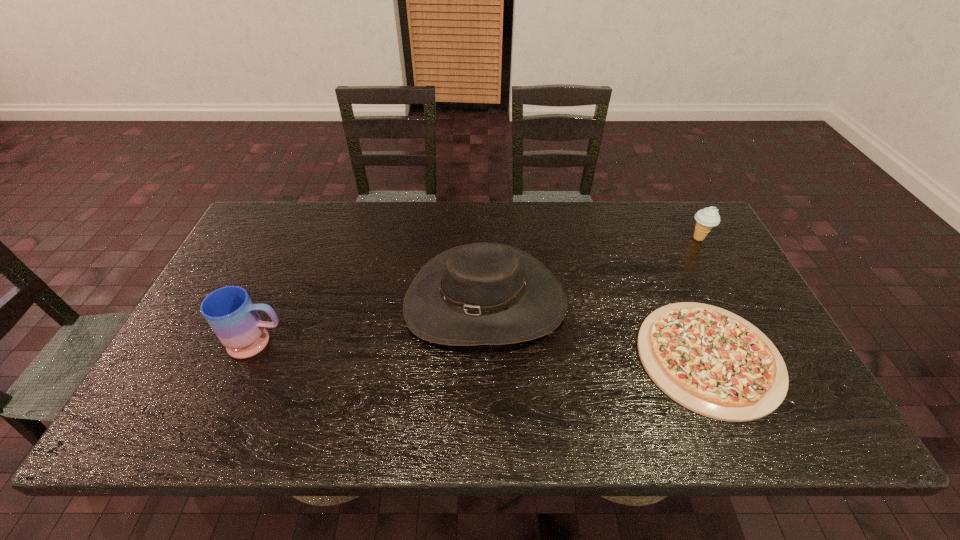
In the image, there is a desktop. Find the location of `vacant space at the far left corner`. vacant space at the far left corner is located at coordinates (313, 201).

Where is `vacant space at the near right corner`? This screenshot has width=960, height=540. vacant space at the near right corner is located at coordinates (795, 407).

Identify the location of free space that is in between the shortest object and the mug. 484,350.

Identify the location of free spot between the cowboy hat and the pizza. Image resolution: width=960 pixels, height=540 pixels. (597, 330).

Where is `free space between the icecream and the cowboy hat`? The image size is (960, 540). free space between the icecream and the cowboy hat is located at coordinates pos(591,271).

You are a GUI agent. You are given a task and a screenshot of the screen. Output one action in this format:
    pyautogui.click(x=<x>, y=<y>)
    Task: Click on the free spot between the pizza and the third tallest object
    The image size is (960, 540).
    Given the screenshot: What is the action you would take?
    pyautogui.click(x=704, y=298)

The height and width of the screenshot is (540, 960). I want to click on free space between the mug and the third object from right to left, so [372, 323].

Identify the location of free space between the mug and the second object from left to right. Image resolution: width=960 pixels, height=540 pixels. (372, 323).

Choose which object is the nearest neighbor to the farthest object. Please provide its 2D coordinates. Your answer should be formatted as a tuple, i.e. [(x, y)], where the tuple contains the x and y coordinates of a point satisfying the conditions above.

[(711, 361)]

Identify which object is the third nearest to the second shortest object. Please provide its 2D coordinates. Your answer should be formatted as a tuple, i.e. [(x, y)], where the tuple contains the x and y coordinates of a point satisfying the conditions above.

[(230, 312)]